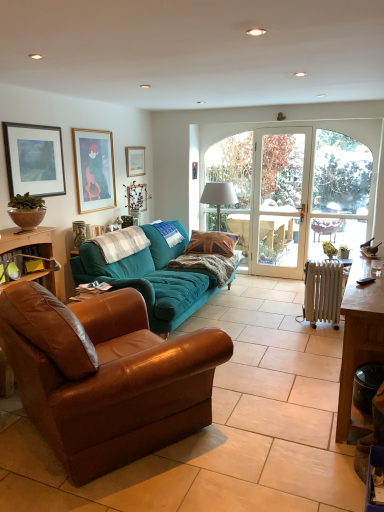
Question: Which direction should I rotate to look at teal fabric couch at center, the first studio couch positioned from the back?

Choices:
 (A) left
 (B) right

Answer: (A)

Question: Is brown wooden table at right aimed at teal fabric couch at center, which is the 2th studio couch in front-to-back order?

Choices:
 (A) yes
 (B) no

Answer: (A)

Question: Is brown wooden table at right wider than teal fabric couch at center, which is the 2th studio couch in front-to-back order?

Choices:
 (A) yes
 (B) no

Answer: (B)

Question: Is teal fabric couch at center, which is the 2th studio couch in front-to-back order, inside brown wooden table at right?

Choices:
 (A) no
 (B) yes

Answer: (A)

Question: Can you confirm if brown wooden table at right is shorter than teal fabric couch at center, the first studio couch positioned from the back?

Choices:
 (A) yes
 (B) no

Answer: (A)

Question: From a real-world perspective, does brown wooden table at right sit lower than teal fabric couch at center, the first studio couch positioned from the back?

Choices:
 (A) yes
 (B) no

Answer: (A)

Question: Are brown wooden table at right and teal fabric couch at center, which is the 2th studio couch in front-to-back order, making contact?

Choices:
 (A) yes
 (B) no

Answer: (B)

Question: Does matte ceramic vase at upper left appear on the right side of teal fabric couch at center, the first studio couch positioned from the back?

Choices:
 (A) no
 (B) yes

Answer: (A)

Question: From the image's perspective, is matte ceramic vase at upper left located above teal fabric couch at center, the first studio couch positioned from the back?

Choices:
 (A) yes
 (B) no

Answer: (A)

Question: Would you consider matte ceramic vase at upper left to be distant from teal fabric couch at center, which is the 2th studio couch in front-to-back order?

Choices:
 (A) no
 (B) yes

Answer: (A)

Question: Is matte ceramic vase at upper left turned away from teal fabric couch at center, which is the 2th studio couch in front-to-back order?

Choices:
 (A) no
 (B) yes

Answer: (A)

Question: Does matte ceramic vase at upper left have a lesser width compared to teal fabric couch at center, the first studio couch positioned from the back?

Choices:
 (A) no
 (B) yes

Answer: (B)

Question: Can you confirm if matte ceramic vase at upper left is taller than teal fabric couch at center, the first studio couch positioned from the back?

Choices:
 (A) no
 (B) yes

Answer: (A)

Question: Is metallic radiator at lower right facing away from wooden picture frame at upper left, which ranks as the 2th picture frame in front-to-back order?

Choices:
 (A) no
 (B) yes

Answer: (A)